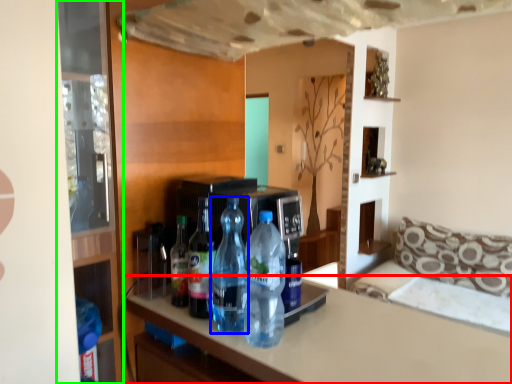
Question: Estimate the real-world distances between objects in this image. Which object is closer to countertop (highlighted by a red box), bottle (highlighted by a blue box) or glass door (highlighted by a green box)?

Choices:
 (A) bottle
 (B) glass door

Answer: (A)